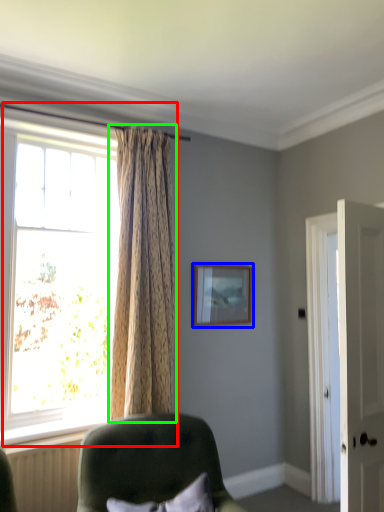
Question: Which is nearer to the window (highlighted by a red box)? picture frame (highlighted by a blue box) or curtain (highlighted by a green box).

Choices:
 (A) picture frame
 (B) curtain

Answer: (B)